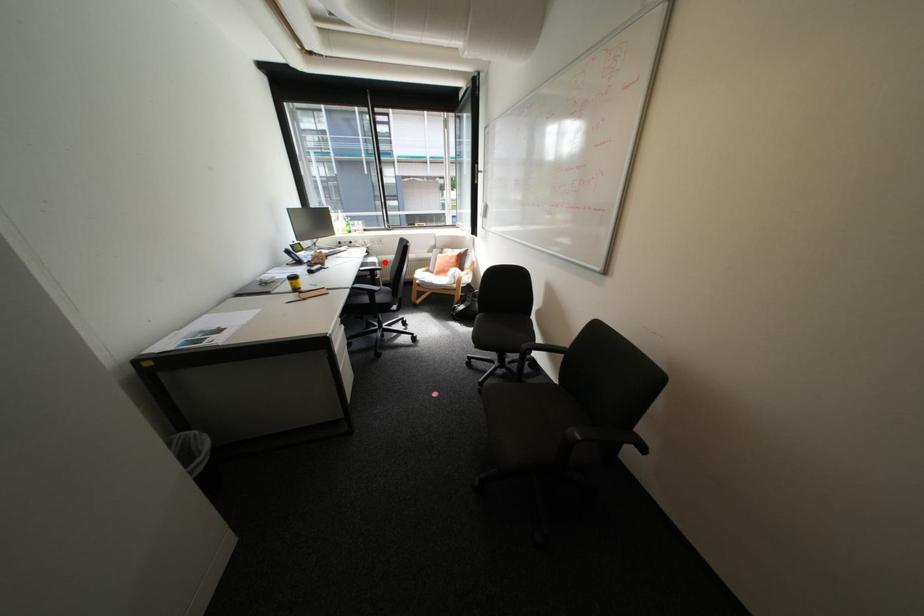
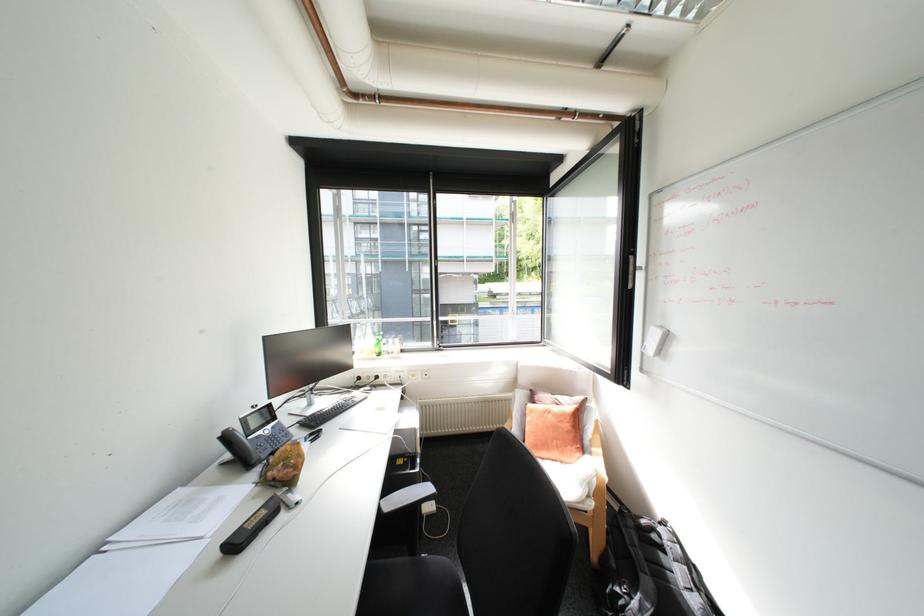
Locate, in the second image, the point that corresponds to the highlighted location in the first image.

(424, 429)